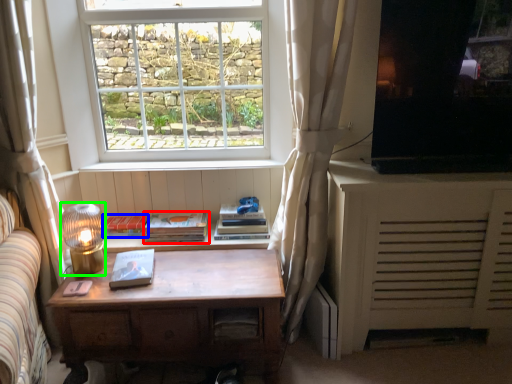
Question: Estimate the real-world distances between objects in this image. Which object is closer to paperback book (highlighted by a red box), paperback book (highlighted by a blue box) or lamp (highlighted by a green box)?

Choices:
 (A) paperback book
 (B) lamp

Answer: (A)